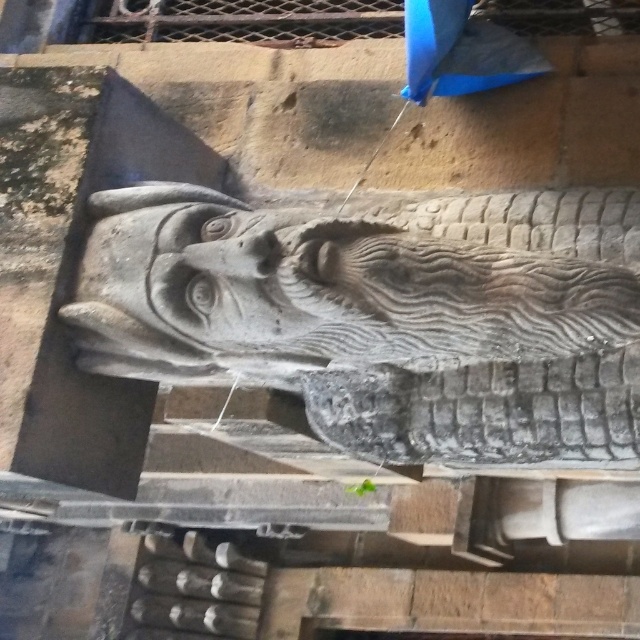
Can you confirm if gray stone dragon at center is bigger than blue fabric umbrella at upper center?

Yes, gray stone dragon at center is bigger than blue fabric umbrella at upper center.

At what (x,y) coordinates should I click in order to perform the action: click on gray stone dragon at center. Please return your answer as a coordinate pair (x, y). Looking at the image, I should click on pyautogui.click(x=368, y=326).

At what (x,y) coordinates should I click in order to perform the action: click on gray stone dragon at center. Please return your answer as a coordinate pair (x, y). The image size is (640, 640). Looking at the image, I should click on (368, 326).